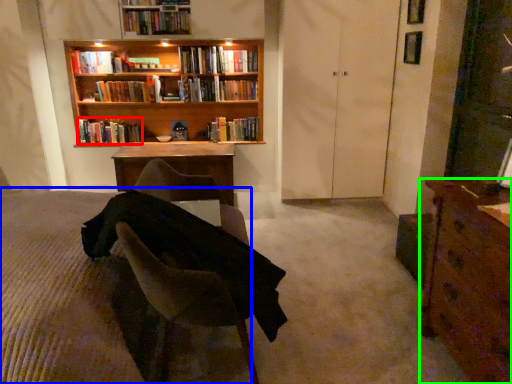
Question: Which is farther away from book (highlighted by a red box)? bed frame (highlighted by a blue box) or desk (highlighted by a green box)?

Choices:
 (A) bed frame
 (B) desk

Answer: (B)